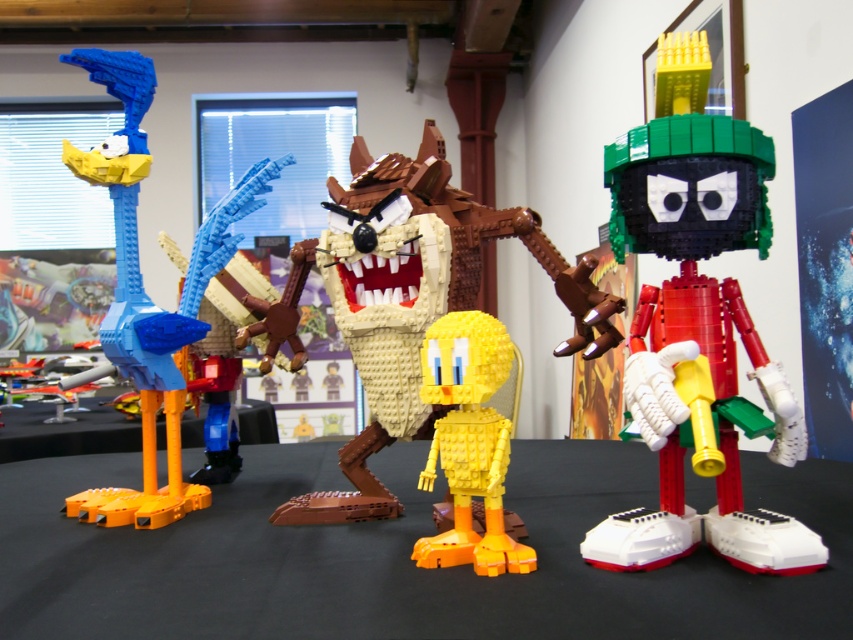
You are a photographer setting up a shot of the LEGO models. You need to ensure that the camera is positioned so that the black plastic table at center is in the center of the frame. Given that the point marking the black plastic table at center is at coordinates (402, 556), what adjustment should you make to the camera position?

The point marking the black plastic table at center is at coordinates (402, 556), which means the camera should be adjusted to move the center of the frame to align with this point to ensure the black plastic table at center is centered.

You are organizing a LEGO exhibition and need to place the brick red lego figure at right and the orange matte table at lower left on a display shelf. Based on their positions in the image, which object should you place first to maintain the correct spatial arrangement?

The orange matte table at lower left should be placed first because the brick red lego figure at right is positioned to its right side, meaning the table is on the left and the figure is on the right.